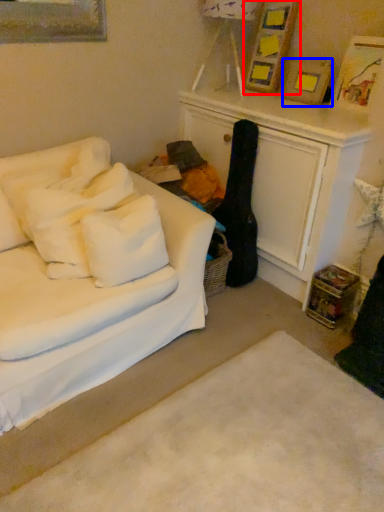
Question: Which object appears farthest to the camera in this image, picture frame (highlighted by a red box) or picture frame (highlighted by a blue box)?

Choices:
 (A) picture frame
 (B) picture frame

Answer: (A)